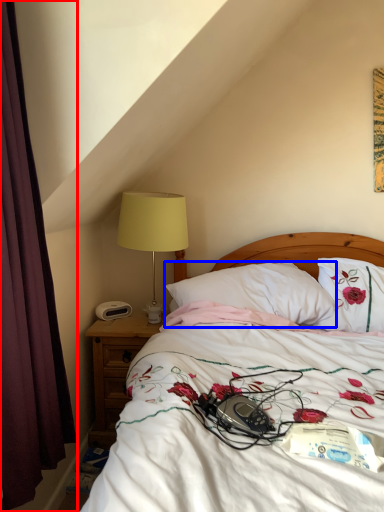
Question: Among these objects, which one is nearest to the camera, curtain (highlighted by a red box) or pillow (highlighted by a blue box)?

Choices:
 (A) curtain
 (B) pillow

Answer: (A)